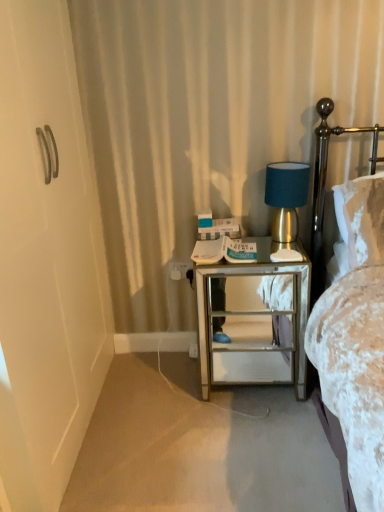
At what (x,y) coordinates should I click in order to perform the action: click on clear glass nightstand at center. Please return your answer as a coordinate pair (x, y). The height and width of the screenshot is (512, 384). Looking at the image, I should click on (252, 325).

Measure the distance between carpet at lower left and camera.

carpet at lower left is 1.37 meters from camera.

Describe the element at coordinates (325, 184) in the screenshot. I see `gold metallic headboard at right` at that location.

Where is `gold metallic table lamp at right`? The width and height of the screenshot is (384, 512). gold metallic table lamp at right is located at coordinates (286, 201).

Where is `white plastic electric outlet at center`? Image resolution: width=384 pixels, height=512 pixels. white plastic electric outlet at center is located at coordinates (181, 270).

Which object is further away from the camera taking this photo, carpet at lower left or gold metallic table lamp at right?

gold metallic table lamp at right is further away from the camera.

Is gold metallic table lamp at right located within carpet at lower left?

No, carpet at lower left does not contain gold metallic table lamp at right.

Is carpet at lower left facing away from gold metallic table lamp at right?

carpet at lower left does not have its back to gold metallic table lamp at right.

Considering the sizes of carpet at lower left and gold metallic table lamp at right in the image, is carpet at lower left taller or shorter than gold metallic table lamp at right?

carpet at lower left is shorter than gold metallic table lamp at right.

Is clear glass nightstand at center oriented away from gold metallic table lamp at right?

No, clear glass nightstand at center is not facing the opposite direction of gold metallic table lamp at right.

Is clear glass nightstand at center in contact with gold metallic table lamp at right?

No.

The image size is (384, 512). In order to click on nightstand on the left of the gold metallic table lamp at right in this screenshot , I will do `click(252, 325)`.

Based on the photo, which of these two, gold metallic headboard at right or gold metallic table lamp at right, stands shorter?

gold metallic table lamp at right is shorter.

Can gold metallic table lamp at right be found inside gold metallic headboard at right?

Actually, gold metallic table lamp at right is outside gold metallic headboard at right.

Considering the sizes of objects gold metallic headboard at right and gold metallic table lamp at right in the image provided, who is smaller, gold metallic headboard at right or gold metallic table lamp at right?

gold metallic table lamp at right is smaller.

Is gold metallic headboard at right placed right next to clear glass nightstand at center?

gold metallic headboard at right is not next to clear glass nightstand at center, and they're not touching.

Is clear glass nightstand at center at the back of gold metallic headboard at right?

No, gold metallic headboard at right's orientation is not away from clear glass nightstand at center.

Is gold metallic headboard at right at the right side of clear glass nightstand at center?

Yes.

Can you confirm if gold metallic headboard at right is thinner than carpet at lower left?

Indeed, gold metallic headboard at right has a lesser width compared to carpet at lower left.

Are gold metallic headboard at right and carpet at lower left located far from each other?

No, gold metallic headboard at right is not far away from carpet at lower left.

Based on the photo, from a real-world perspective, is gold metallic headboard at right below carpet at lower left?

No, from a real-world perspective, gold metallic headboard at right is not below carpet at lower left.

Is carpet at lower left surrounded by gold metallic headboard at right?

No.

Looking at this image, from their relative heights in the image, would you say gold metallic table lamp at right is taller or shorter than carpet at lower left?

Clearly, gold metallic table lamp at right is taller compared to carpet at lower left.

Which of these two, gold metallic table lamp at right or carpet at lower left, is thinner?

With smaller width is gold metallic table lamp at right.

Is gold metallic table lamp at right oriented towards carpet at lower left?

No, gold metallic table lamp at right is not facing towards carpet at lower left.

Who is smaller, clear glass nightstand at center or gold metallic headboard at right?

gold metallic headboard at right is smaller.

Which is less distant, (x=220, y=367) or (x=322, y=290)?

Point (x=220, y=367).

Does clear glass nightstand at center turn towards gold metallic headboard at right?

No, clear glass nightstand at center does not turn towards gold metallic headboard at right.

I want to click on plain that is under the gold metallic table lamp at right (from a real-world perspective), so click(199, 446).

Where is `nightstand that is on the left side of gold metallic table lamp at right`? The width and height of the screenshot is (384, 512). nightstand that is on the left side of gold metallic table lamp at right is located at coordinates (x=252, y=325).

Based on their spatial positions, is gold metallic headboard at right or gold metallic table lamp at right closer to clear glass nightstand at center?

gold metallic table lamp at right is closer to clear glass nightstand at center.

Looking at the image, which one is located further to clear glass nightstand at center, gold metallic headboard at right or white plastic electric outlet at center?

white plastic electric outlet at center is further to clear glass nightstand at center.

Which object lies further to the anchor point carpet at lower left, gold metallic headboard at right or clear glass nightstand at center?

Based on the image, gold metallic headboard at right appears to be further to carpet at lower left.

From the image, which object appears to be nearer to white plastic electric outlet at center, gold metallic table lamp at right or clear glass nightstand at center?

clear glass nightstand at center lies closer to white plastic electric outlet at center than the other object.

Estimate the real-world distances between objects in this image. Which object is further from gold metallic table lamp at right, white plastic electric outlet at center or carpet at lower left?

The object further to gold metallic table lamp at right is carpet at lower left.

In the scene shown: When comparing their distances from gold metallic table lamp at right, does carpet at lower left or clear glass nightstand at center seem further?

carpet at lower left lies further to gold metallic table lamp at right than the other object.

Considering their positions, is gold metallic headboard at right positioned closer to carpet at lower left than white plastic electric outlet at center?

white plastic electric outlet at center is positioned closer to the anchor carpet at lower left.

From the picture: Which object lies nearer to the anchor point gold metallic headboard at right, carpet at lower left or clear glass nightstand at center?

clear glass nightstand at center lies closer to gold metallic headboard at right than the other object.

At what (x,y) coordinates should I click in order to perform the action: click on headboard between gold metallic table lamp at right and clear glass nightstand at center vertically. Please return your answer as a coordinate pair (x, y). Looking at the image, I should click on (325, 184).

The image size is (384, 512). Find the location of `nightstand situated between white plastic electric outlet at center and gold metallic headboard at right from left to right`. nightstand situated between white plastic electric outlet at center and gold metallic headboard at right from left to right is located at coordinates (252, 325).

I want to click on table lamp situated between white plastic electric outlet at center and gold metallic headboard at right from left to right, so click(x=286, y=201).

This screenshot has width=384, height=512. Find the location of `nightstand located between carpet at lower left and white plastic electric outlet at center in the depth direction`. nightstand located between carpet at lower left and white plastic electric outlet at center in the depth direction is located at coordinates pyautogui.click(x=252, y=325).